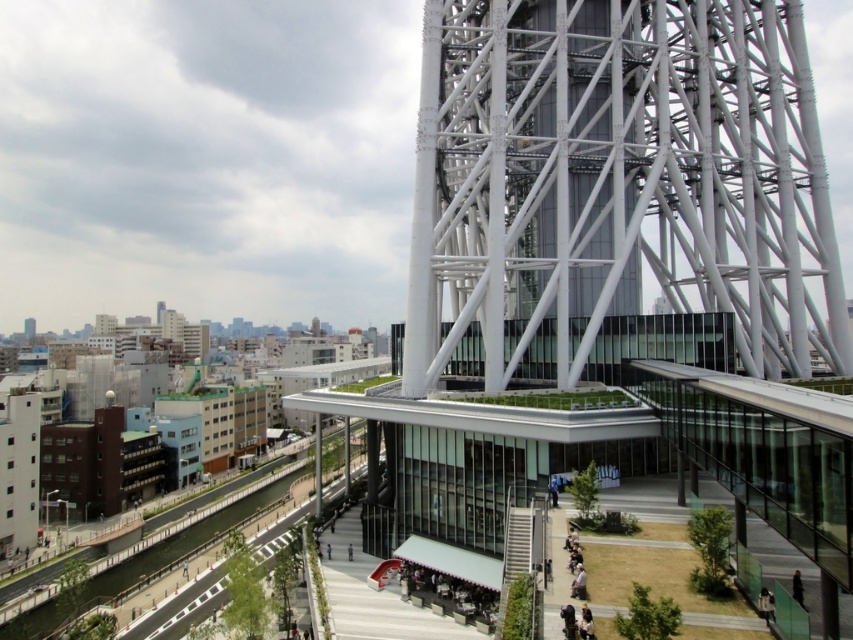
Is dark gray fabric jacket at lower center below black fabric person at lower right?

Yes, dark gray fabric jacket at lower center is below black fabric person at lower right.

Between point (772, 618) and point (793, 586), which one is positioned in front?

Point (772, 618) is in front.

Who is more forward, (766, 625) or (798, 570)?

Positioned in front is point (766, 625).

The height and width of the screenshot is (640, 853). I want to click on dark gray fabric jacket at lower center, so click(764, 604).

Does white metallic tower at center appear on the left side of black fabric person at lower right?

Yes, white metallic tower at center is to the left of black fabric person at lower right.

Between white metallic tower at center and black fabric person at lower right, which one is positioned higher?

Positioned higher is white metallic tower at center.

Who is more forward, [619,83] or [796,596]?

Point [796,596]

Locate an element on the screen. The image size is (853, 640). white metallic tower at center is located at coordinates click(x=616, y=184).

Can you confirm if white metallic tower at center is positioned to the right of dark gray fabric jacket at lower center?

Incorrect, white metallic tower at center is not on the right side of dark gray fabric jacket at lower center.

Does point (711, 304) come closer to viewer compared to point (766, 602)?

No, it is behind (766, 602).

At what (x,y) coordinates should I click in order to perform the action: click on white metallic tower at center. Please return your answer as a coordinate pair (x, y). This screenshot has width=853, height=640. Looking at the image, I should click on (616, 184).